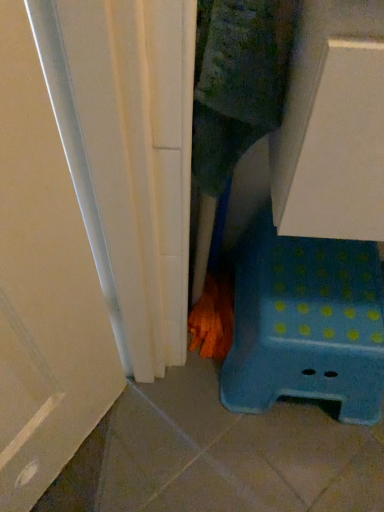
You are a GUI agent. You are given a task and a screenshot of the screen. Output one action in this format:
    pyautogui.click(x=<x>, y=<y>)
    Task: Click on the free location above blue plastic stool at lower right (from a real-world perspective)
    
    Given the screenshot: What is the action you would take?
    (308, 274)